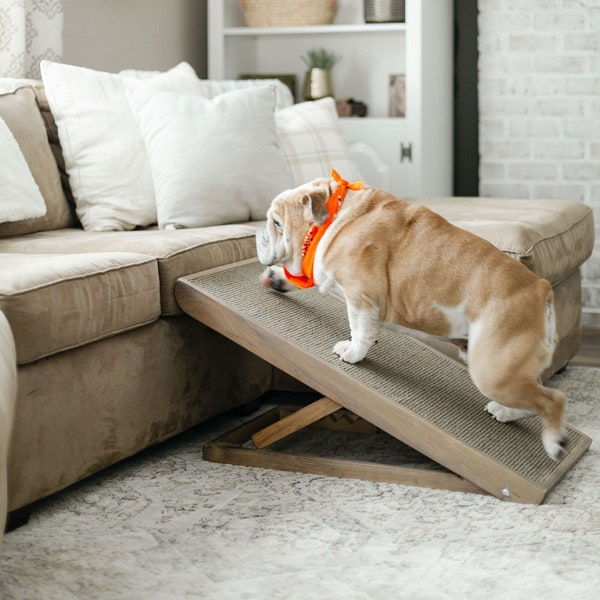
At what (x,y) coordinates should I click in order to perform the action: click on cushion. Please return your answer as a coordinate pair (x, y). Looking at the image, I should click on (555, 224), (200, 248), (89, 286).